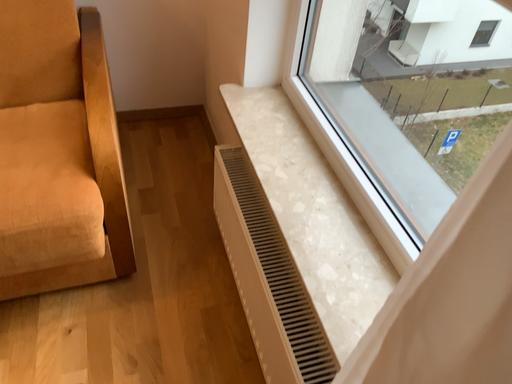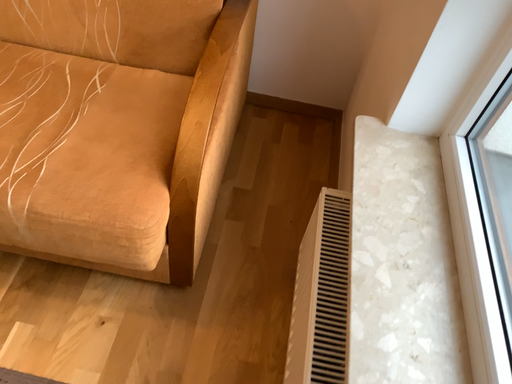
Question: Which way did the camera rotate in the video?

Choices:
 (A) rotated right
 (B) rotated left

Answer: (B)